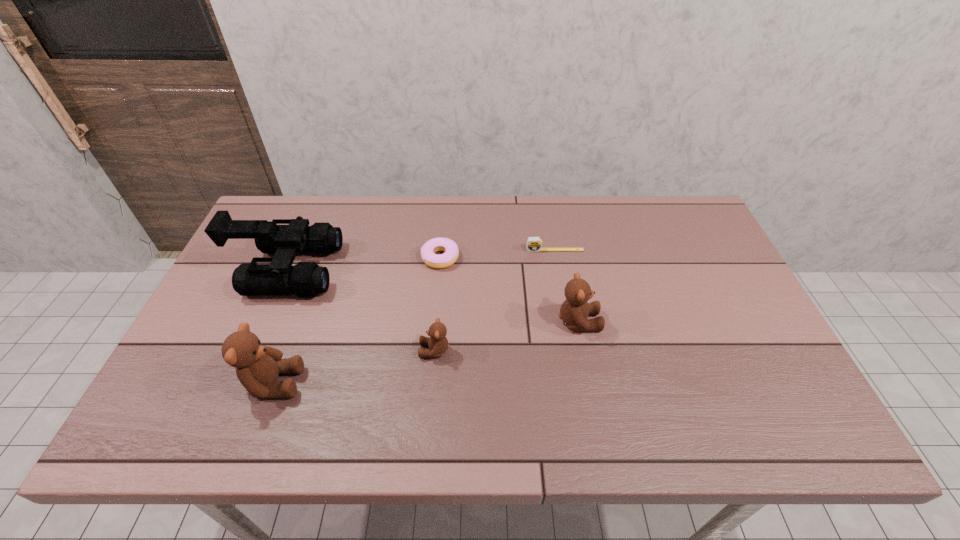
The height and width of the screenshot is (540, 960). What are the coordinates of `vacant space located 0.220m on the face of the second teddy bear from right to left` in the screenshot? It's located at (331, 350).

The width and height of the screenshot is (960, 540). I want to click on vacant region located on the face of the second teddy bear from right to left, so click(271, 350).

This screenshot has width=960, height=540. I want to click on free space located 0.260m on the face of the third nearest object, so click(x=699, y=321).

Locate an element on the screen. The width and height of the screenshot is (960, 540). free space located on the front lenses of the binoculars is located at coordinates (466, 269).

In order to click on vacant region located 0.170m at the front of the tape measure with the tape extended in this screenshot , I will do `click(563, 293)`.

Find the location of a particular element. The height and width of the screenshot is (540, 960). free space located on the left of the doughnut is located at coordinates (372, 258).

Locate an element on the screen. object that is at the far edge is located at coordinates (306, 279).

Where is `object located at the near edge`? object located at the near edge is located at coordinates (257, 367).

I want to click on object present at the left edge, so [306, 279].

Find the location of a particular element. object present at the far left corner is located at coordinates (306, 279).